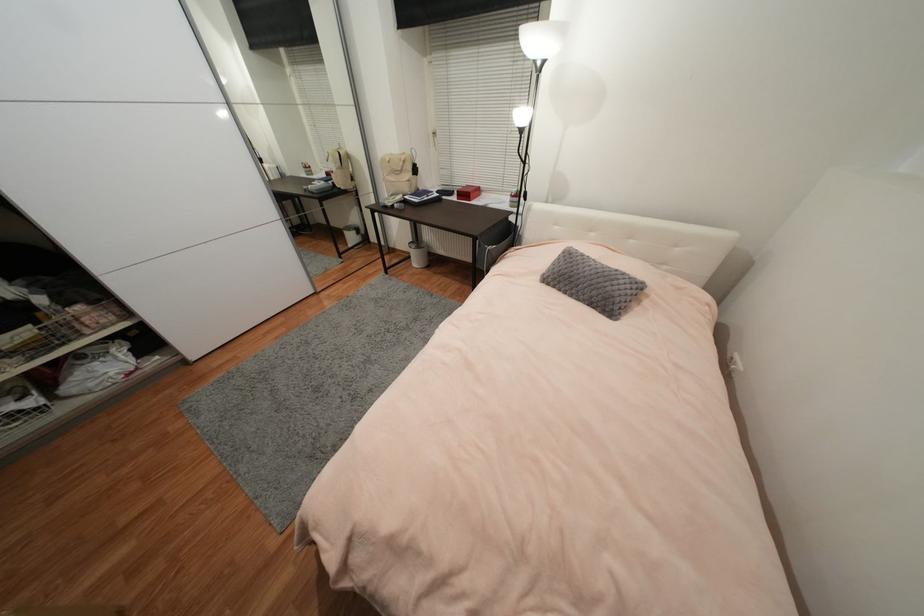
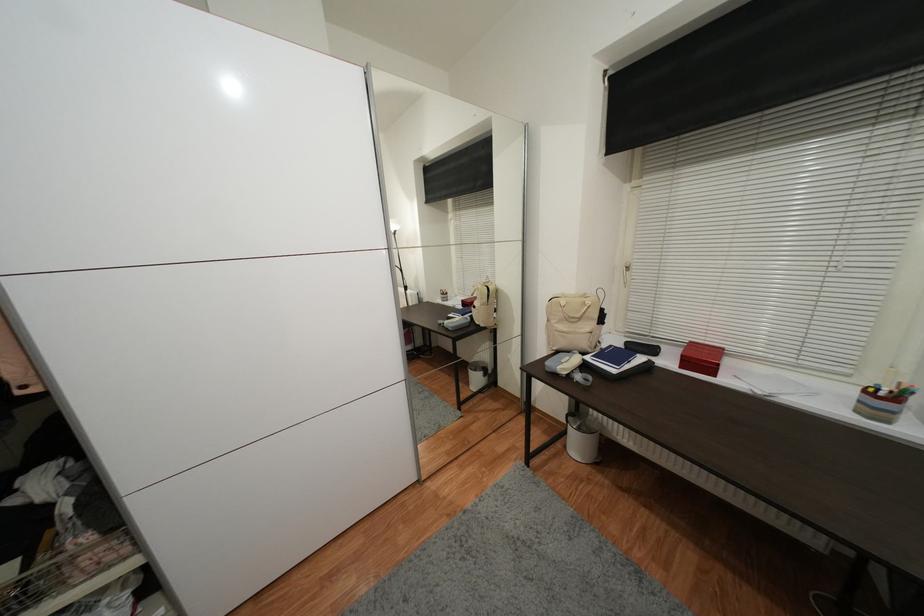
Locate, in the second image, the point that corresponds to (x=410, y=198) in the first image.

(592, 360)